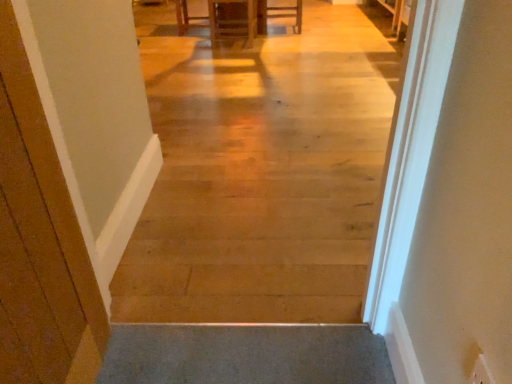
Locate an element on the screen. The height and width of the screenshot is (384, 512). free space to the back side of wooden floor at center is located at coordinates (245, 252).